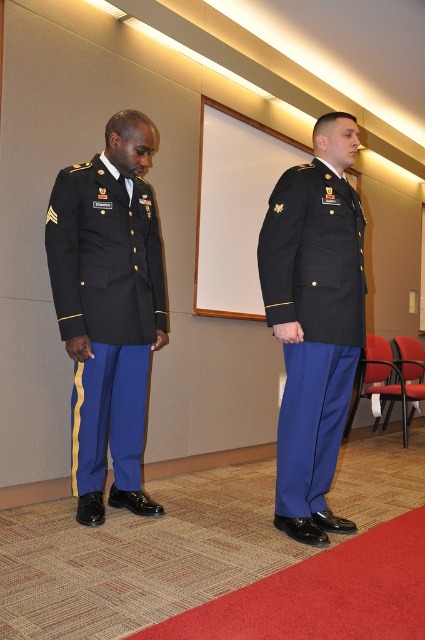
Question: Which point is farther to the camera?

Choices:
 (A) (79, 420)
 (B) (312, 232)

Answer: (A)

Question: Is matte black uniform at left positioned at the back of matte black uniform at center?

Choices:
 (A) yes
 (B) no

Answer: (A)

Question: From the image, what is the correct spatial relationship of matte black uniform at left in relation to matte black uniform at center?

Choices:
 (A) left
 (B) right

Answer: (A)

Question: Is matte black uniform at left below matte black uniform at center?

Choices:
 (A) yes
 (B) no

Answer: (B)

Question: Which point is farther to the camera?

Choices:
 (A) (291, 483)
 (B) (113, 378)

Answer: (B)